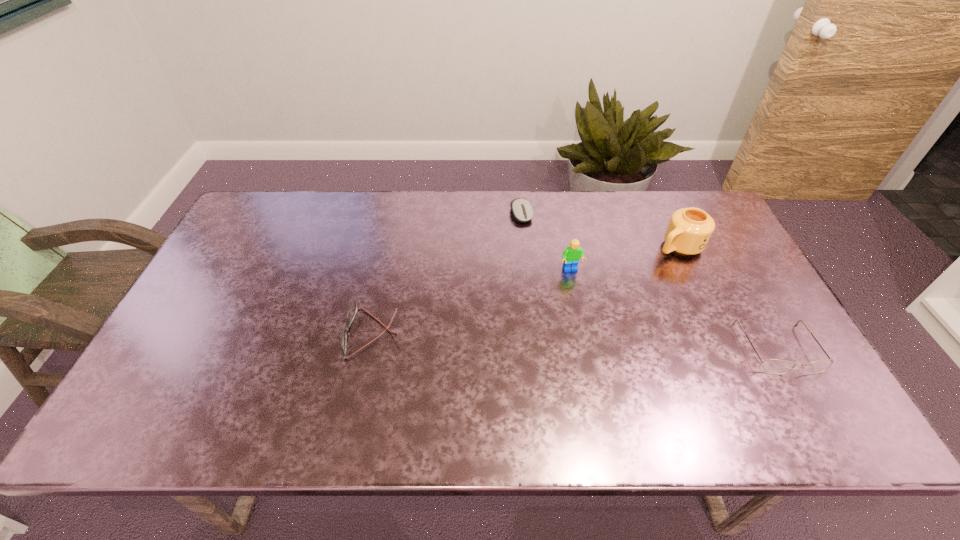
The image size is (960, 540). I want to click on vacant space located 0.240m on the wheel side of the farthest object, so coord(548,275).

Locate an element on the screen. The image size is (960, 540). blank space located on the wheel side of the farthest object is located at coordinates (551, 280).

Locate an element on the screen. The image size is (960, 540). vacant space located 0.140m on the wheel side of the farthest object is located at coordinates (538, 253).

Where is `free space located 0.360m on the handle side of the fourth nearest object`? The image size is (960, 540). free space located 0.360m on the handle side of the fourth nearest object is located at coordinates (577, 307).

Locate an element on the screen. This screenshot has width=960, height=540. vacant space located 0.350m on the handle side of the fourth nearest object is located at coordinates (580, 306).

Where is `free region located 0.380m on the handle side of the fourth nearest object`? free region located 0.380m on the handle side of the fourth nearest object is located at coordinates (571, 310).

Where is `free location located on the face of the third farthest object`? Image resolution: width=960 pixels, height=540 pixels. free location located on the face of the third farthest object is located at coordinates (584, 298).

Where is `free space located 0.330m on the face of the third farthest object`? The image size is (960, 540). free space located 0.330m on the face of the third farthest object is located at coordinates (614, 372).

The image size is (960, 540). I want to click on vacant space located on the face of the third farthest object, so click(624, 394).

The height and width of the screenshot is (540, 960). I want to click on computer equipment that is at the far edge, so tap(522, 210).